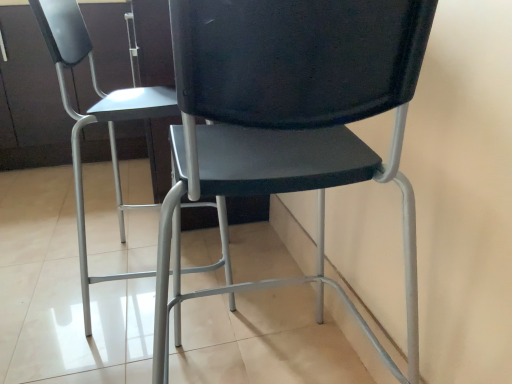
Question: From a real-world perspective, is matte black chair at center, the first chair viewed from the left, above or below matte black chair at center, the 1th chair in the right-to-left sequence?

Choices:
 (A) below
 (B) above

Answer: (B)

Question: Considering the positions of matte black chair at center, the second chair in the right-to-left sequence, and matte black chair at center, the 1th chair in the right-to-left sequence, in the image, is matte black chair at center, the second chair in the right-to-left sequence, taller or shorter than matte black chair at center, the 1th chair in the right-to-left sequence,?

Choices:
 (A) tall
 (B) short

Answer: (A)

Question: Considering the positions of matte black chair at center, the first chair viewed from the left, and matte black chair at center, the second chair positioned from the left, in the image, is matte black chair at center, the first chair viewed from the left, wider or thinner than matte black chair at center, the second chair positioned from the left,?

Choices:
 (A) thin
 (B) wide

Answer: (B)

Question: From the image's perspective, is matte black chair at center, the 1th chair in the right-to-left sequence, located above or below matte black chair at center, the second chair in the right-to-left sequence?

Choices:
 (A) below
 (B) above

Answer: (A)

Question: Is matte black chair at center, the second chair positioned from the left, wider or thinner than matte black chair at center, the second chair in the right-to-left sequence?

Choices:
 (A) wide
 (B) thin

Answer: (B)

Question: From a real-world perspective, is matte black chair at center, the 1th chair in the right-to-left sequence, physically located above or below matte black chair at center, the second chair in the right-to-left sequence?

Choices:
 (A) below
 (B) above

Answer: (A)

Question: Is matte black chair at center, the 1th chair in the right-to-left sequence, spatially inside matte black chair at center, the second chair in the right-to-left sequence, or outside of it?

Choices:
 (A) inside
 (B) outside

Answer: (B)